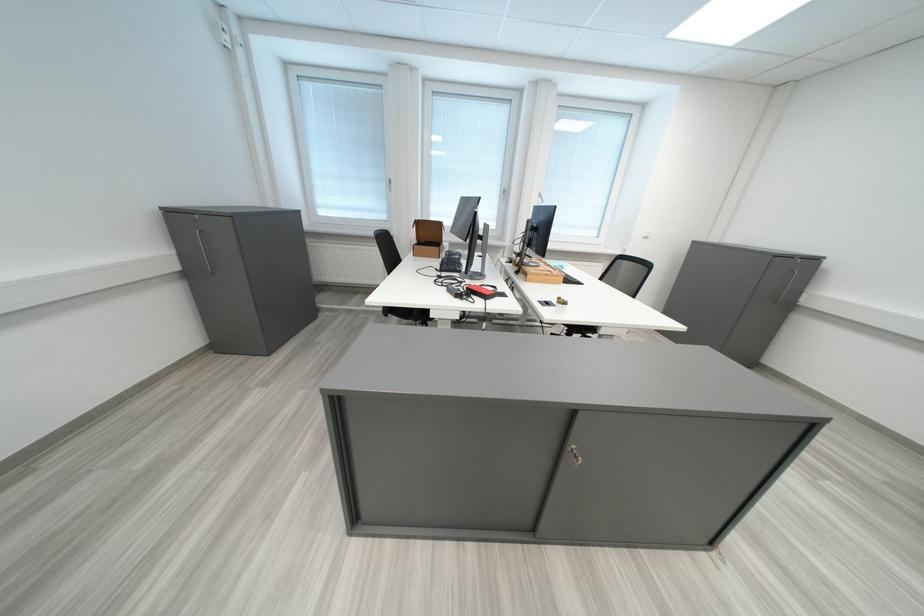
Locate an element on the screen. The width and height of the screenshot is (924, 616). black computer keyboard is located at coordinates (451, 262).